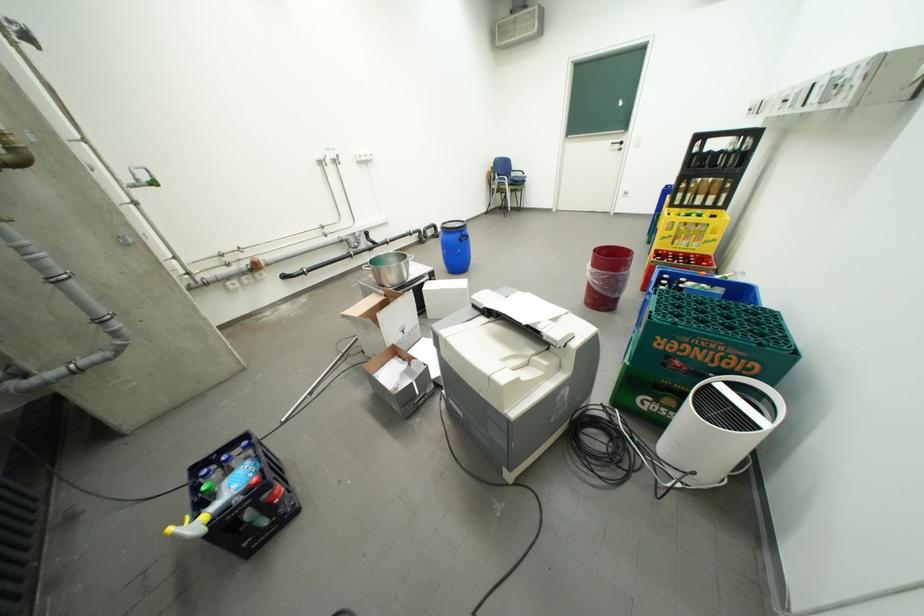
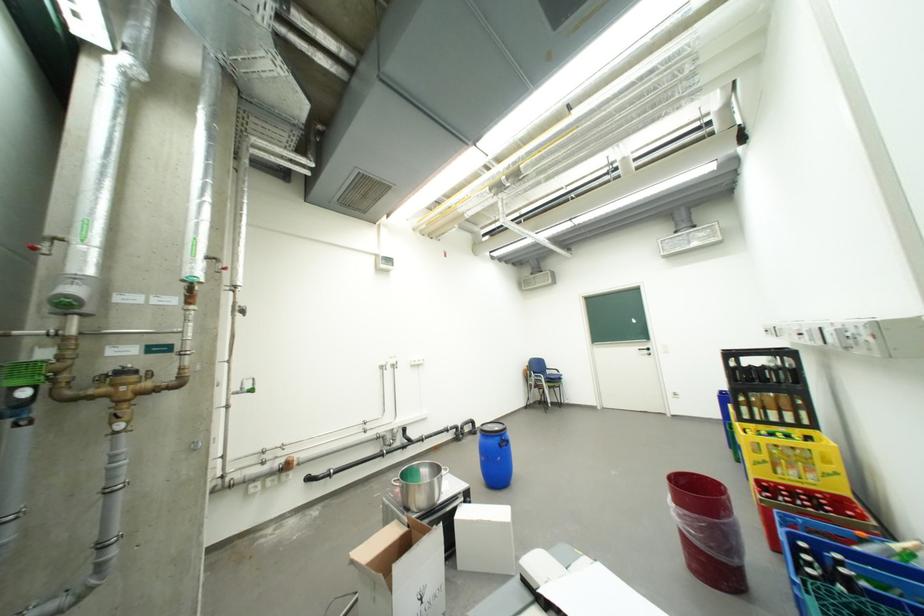
Locate, in the second image, the point that corresponds to [415,257] in the first image.

(447, 471)